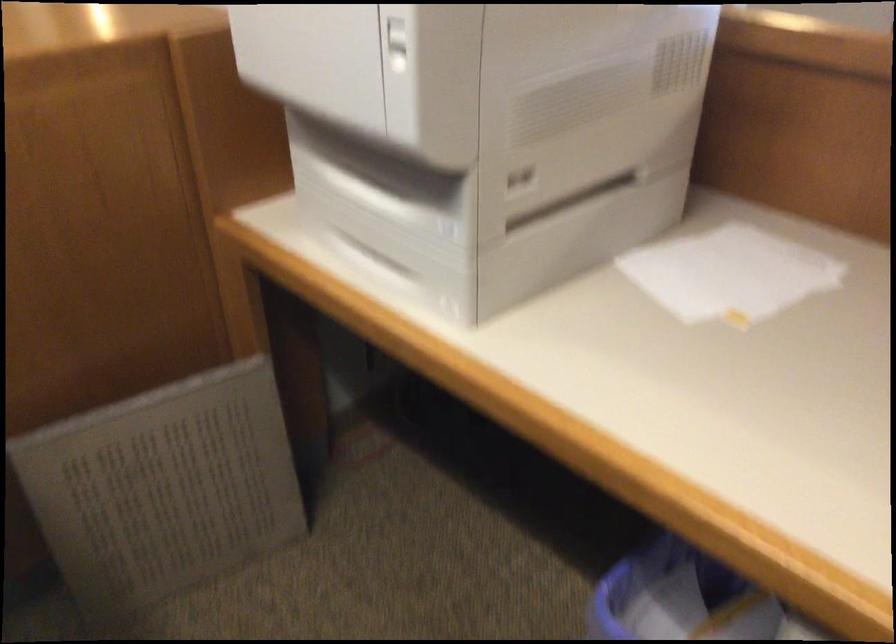
Locate an element on the screen. blue trash can is located at coordinates (679, 598).